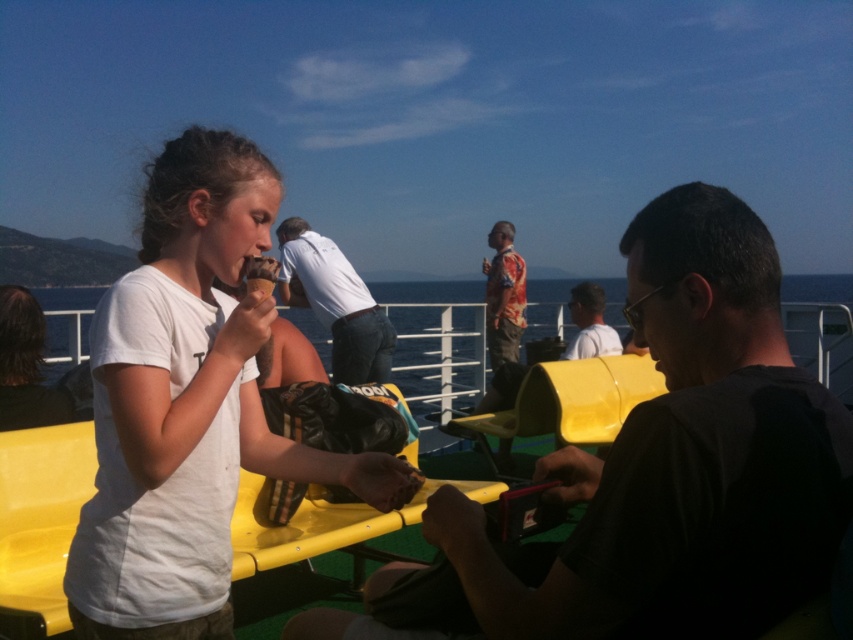
Question: Is white matte t-shirt at center to the right of yellow plastic boat at center from the viewer's perspective?

Choices:
 (A) no
 (B) yes

Answer: (B)

Question: Which object is farther from the camera taking this photo?

Choices:
 (A) white cotton shirt at center
 (B) white matte t-shirt at center

Answer: (A)

Question: Which point is farther to the camera?

Choices:
 (A) white matte t-shirt at center
 (B) yellow plastic boat at center

Answer: (B)

Question: Which point is closer to the camera?

Choices:
 (A) (315, 273)
 (B) (335, 557)
 (C) (247, 291)

Answer: (C)

Question: Is yellow plastic boat at center further to the viewer compared to white cotton shirt at center?

Choices:
 (A) yes
 (B) no

Answer: (B)

Question: Does white matte t-shirt at center have a lesser width compared to light brown leather jacket at center?

Choices:
 (A) no
 (B) yes

Answer: (A)